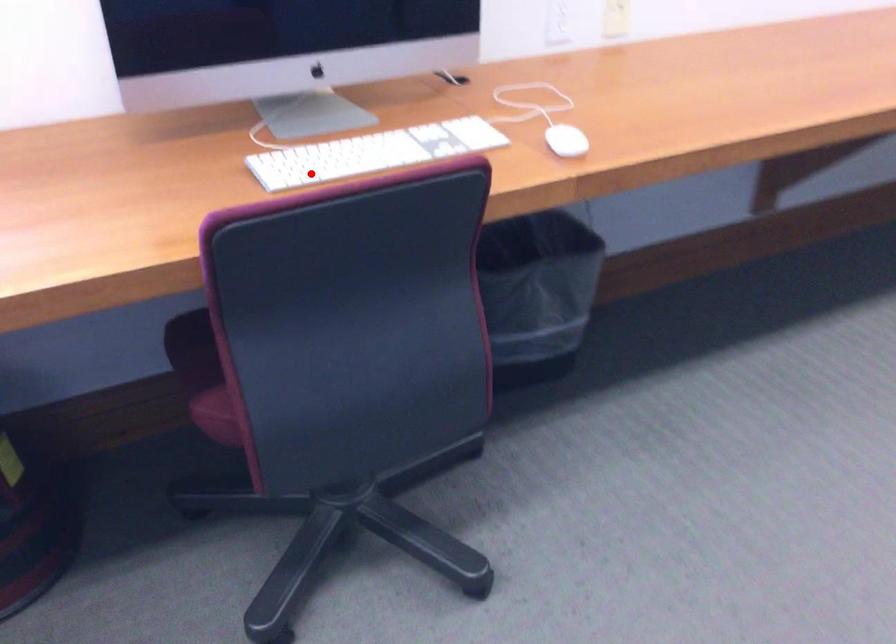
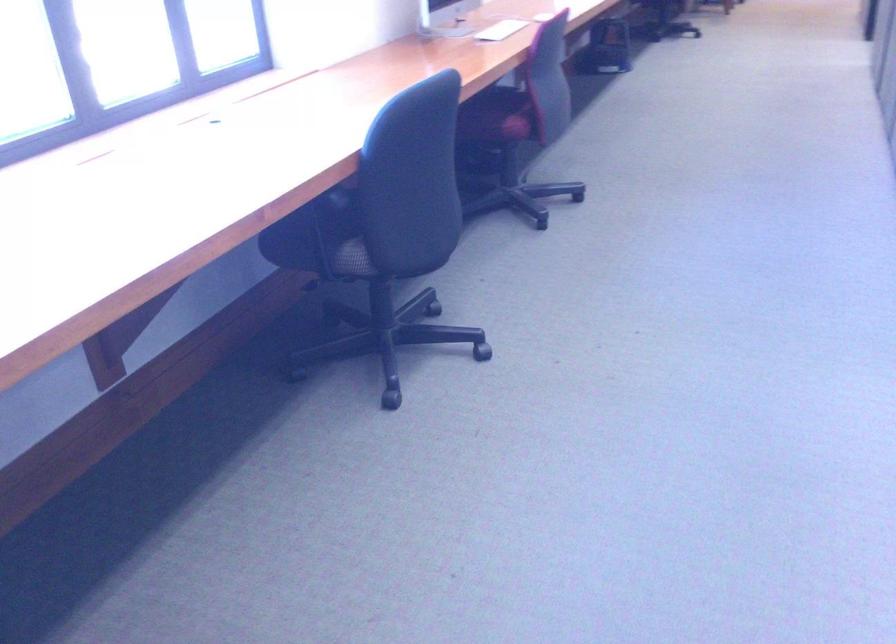
In the second image, find the point that corresponds to the highlighted location in the first image.

(501, 30)